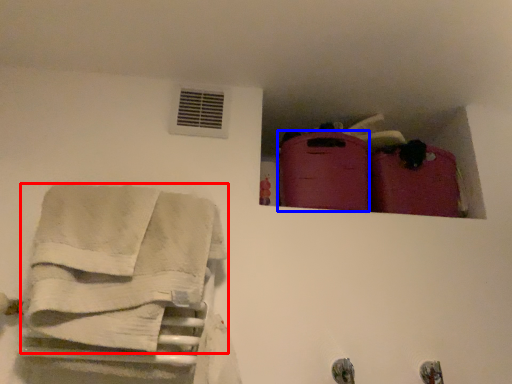
Question: Which point is closer to the camera, towel (highlighted by a red box) or luggage (highlighted by a blue box)?

Choices:
 (A) towel
 (B) luggage

Answer: (A)